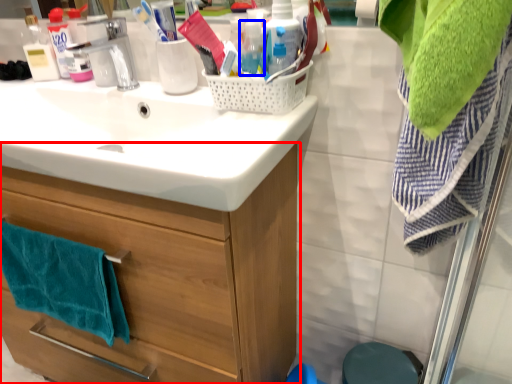
Question: Which of the following is the closest to the observer, bathroom cabinet (highlighted by a red box) or bottle (highlighted by a blue box)?

Choices:
 (A) bathroom cabinet
 (B) bottle

Answer: (A)